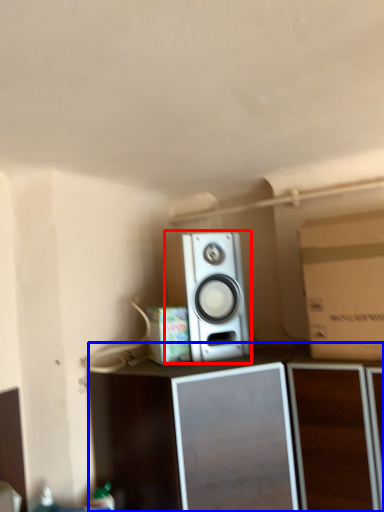
Question: Among these objects, which one is farthest to the camera, home appliance (highlighted by a red box) or furniture (highlighted by a blue box)?

Choices:
 (A) home appliance
 (B) furniture

Answer: (A)